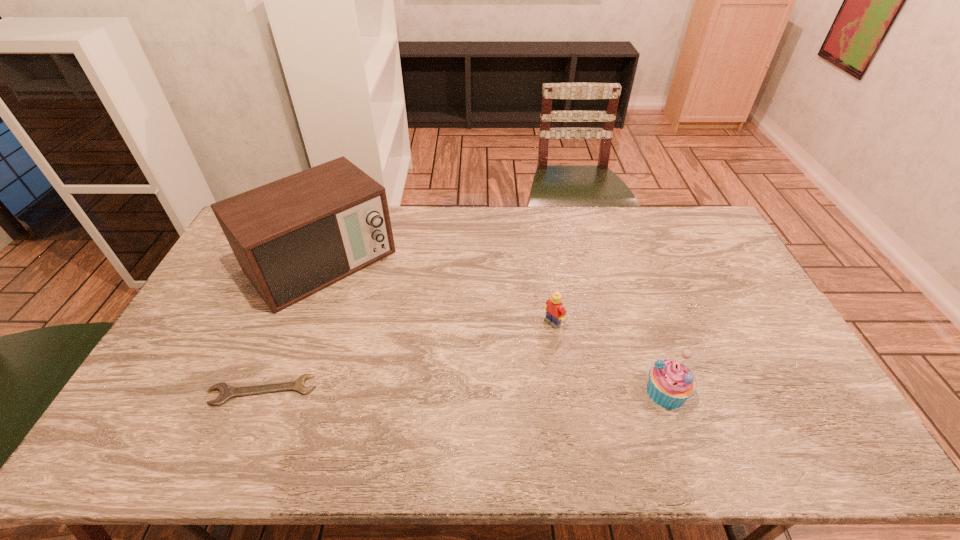
The image size is (960, 540). What are the coordinates of `the shortest object` in the screenshot? It's located at (227, 391).

This screenshot has width=960, height=540. In order to click on muffin in this screenshot , I will do `click(670, 384)`.

Locate an element on the screen. the tallest object is located at coordinates (293, 237).

Where is `Lego`? The width and height of the screenshot is (960, 540). Lego is located at coordinates (555, 312).

Where is `vacant region located 0.140m on the right of the shortest object`? This screenshot has width=960, height=540. vacant region located 0.140m on the right of the shortest object is located at coordinates (369, 390).

This screenshot has height=540, width=960. I want to click on vacant point located 0.290m on the left of the muffin, so click(x=535, y=392).

Where is `free space located on the front-facing side of the radio receiver`? free space located on the front-facing side of the radio receiver is located at coordinates (408, 354).

In order to click on vacant region located on the front-facing side of the radio receiver in this screenshot , I will do `click(406, 352)`.

Where is `blank space located on the front-facing side of the radio receiver`? blank space located on the front-facing side of the radio receiver is located at coordinates (389, 333).

Where is `free space located on the front-facing side of the second object from right to left`? The image size is (960, 540). free space located on the front-facing side of the second object from right to left is located at coordinates (475, 382).